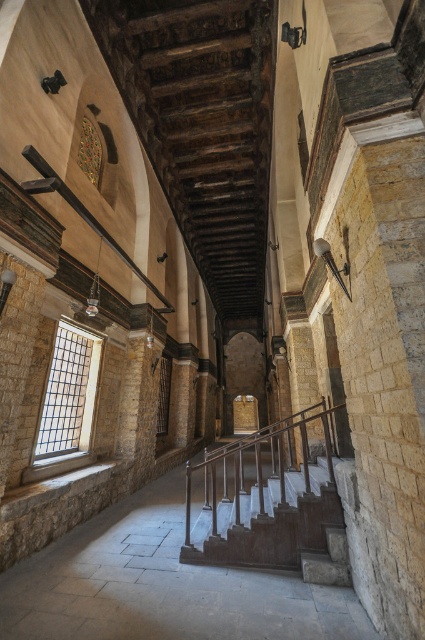
You are standing at the entrance of this historic building and want to go up the dark brown stone stairs at center. If your wheelchair has a turning radius of 1.2 meters, is there enough space to maneuver around the stairs?

The dark brown stone stairs at center are 3.77 meters away from you. Since the wheelchair requires a turning radius of 1.2 meters, and the stairs are positioned centrally, there should be sufficient space to maneuver around them as long as there are no other obstacles nearby.

You are standing at the entrance of the corridor and want to go up the smooth stone staircase at center. Which side of the polished wood railing at center should you walk along to reach it?

The smooth stone staircase at center is to the left of the polished wood railing at center, so you should walk along the left side of the polished wood railing at center to reach it.

You are an architect visiting this historic building and need to determine the spatial relationship between the smooth stone staircase at center and the polished wood railing at center. Which object occupies a larger area in the scene?

The polished wood railing at center occupies a larger area in the scene since the smooth stone staircase at center is smaller than it according to the description.